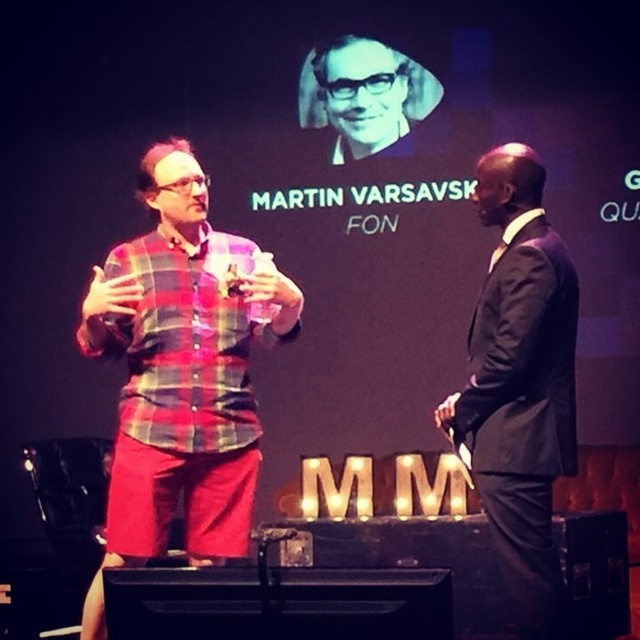
Does plaid fabric shirt at left come in front of black satin suit at right?

No, it is behind black satin suit at right.

Does plaid fabric shirt at left have a larger size compared to black satin suit at right?

Yes, plaid fabric shirt at left is bigger than black satin suit at right.

Between point (182, 182) and point (500, 369), which one is positioned in front?

Point (500, 369) is more forward.

What are the coordinates of `plaid fabric shirt at left` in the screenshot? It's located at (180, 372).

Is point (561, 432) closer to camera compared to point (317, 72)?

Yes, point (561, 432) is closer to viewer.

Does point (525, 163) lie in front of point (381, 134)?

Yes, point (525, 163) is in front of point (381, 134).

Locate an element on the screen. This screenshot has height=640, width=640. black satin suit at right is located at coordinates (520, 381).

Between plaid fabric shirt at left and matte black glasses at upper center, which one appears on the right side from the viewer's perspective?

From the viewer's perspective, matte black glasses at upper center appears more on the right side.

Does plaid fabric shirt at left appear under matte black glasses at upper center?

Yes, plaid fabric shirt at left is below matte black glasses at upper center.

Does point (180, 429) lie in front of point (433, 108)?

Yes, it is in front of point (433, 108).

This screenshot has height=640, width=640. What are the coordinates of `plaid fabric shirt at left` in the screenshot? It's located at (180, 372).